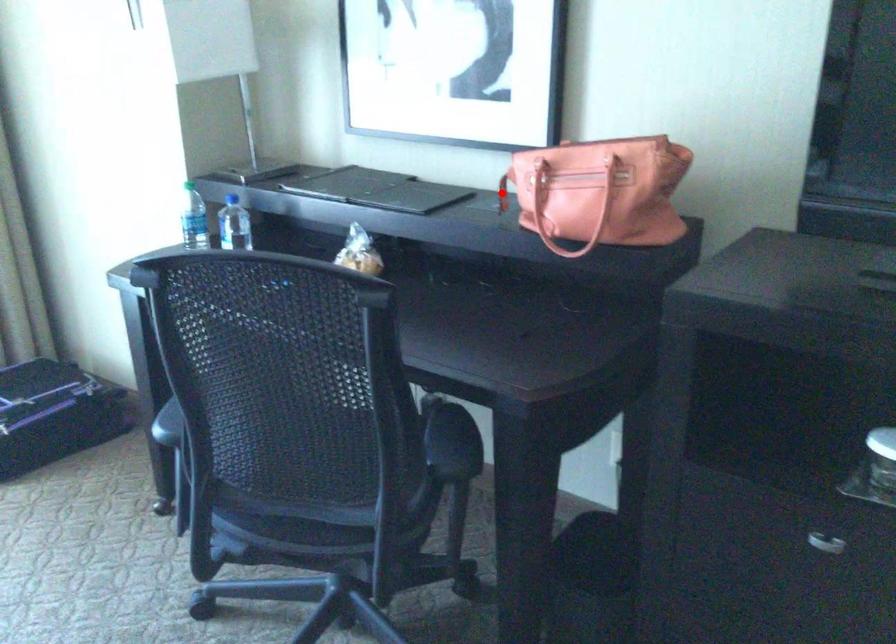
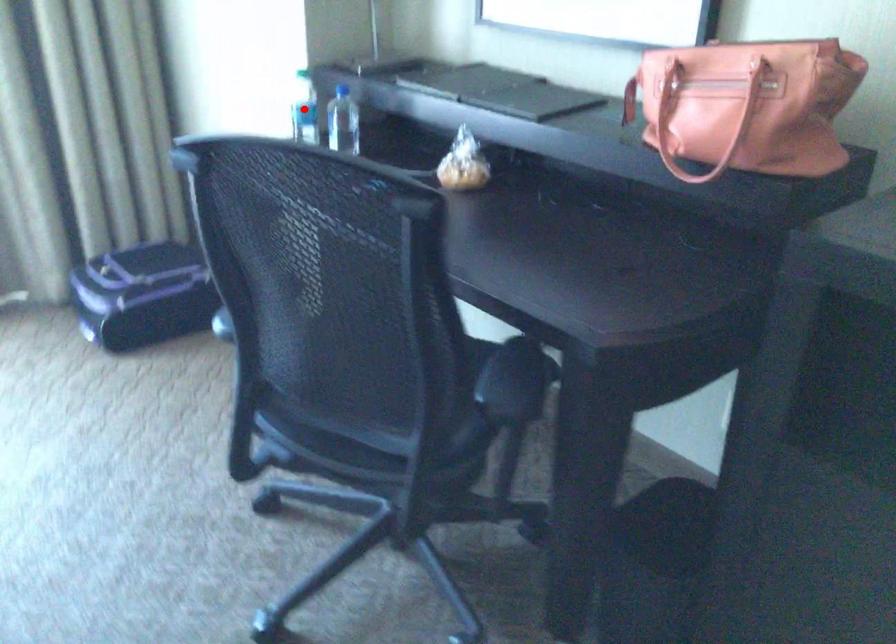
I am providing you with two images of the same scene from different viewpoints. A red point is marked on the first image and another point is marked on the second image. Is the marked point in image1 the same physical position as the marked point in image2?

No